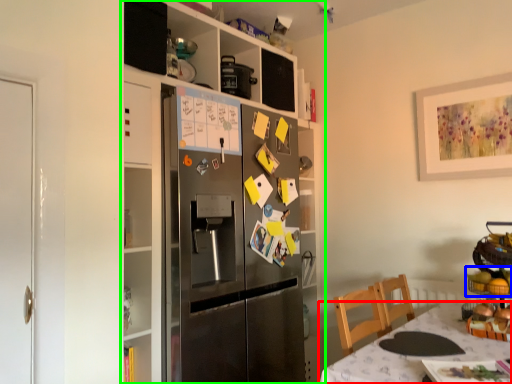
Question: Which object is the closest to the table (highlighted by a red box)? Choose among these: food (highlighted by a blue box) or cabinetry (highlighted by a green box).

Choices:
 (A) food
 (B) cabinetry

Answer: (A)